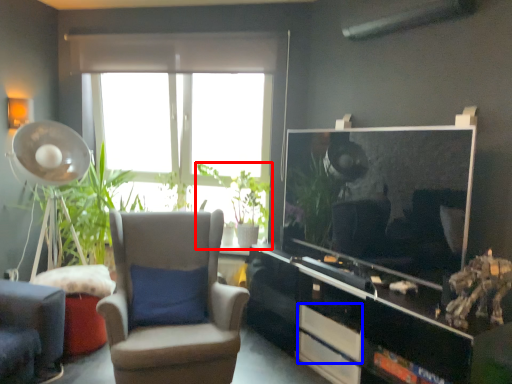
Question: Which point is closer to the camera, houseplant (highlighted by a red box) or drawer (highlighted by a blue box)?

Choices:
 (A) houseplant
 (B) drawer

Answer: (B)